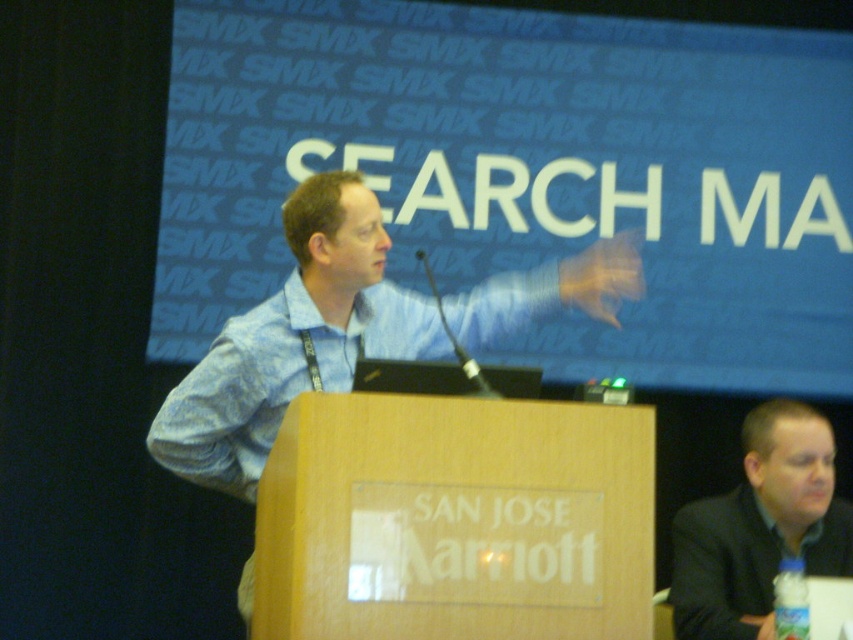
What do you see at coordinates (350, 328) in the screenshot?
I see `blue shirt at center` at bounding box center [350, 328].

From the picture: Is blue shirt at center taller than dark gray suit at lower right?

Yes, blue shirt at center is taller than dark gray suit at lower right.

Is point (248, 429) behind point (851, 544)?

No.

Locate an element on the screen. This screenshot has width=853, height=640. blue shirt at center is located at coordinates (350, 328).